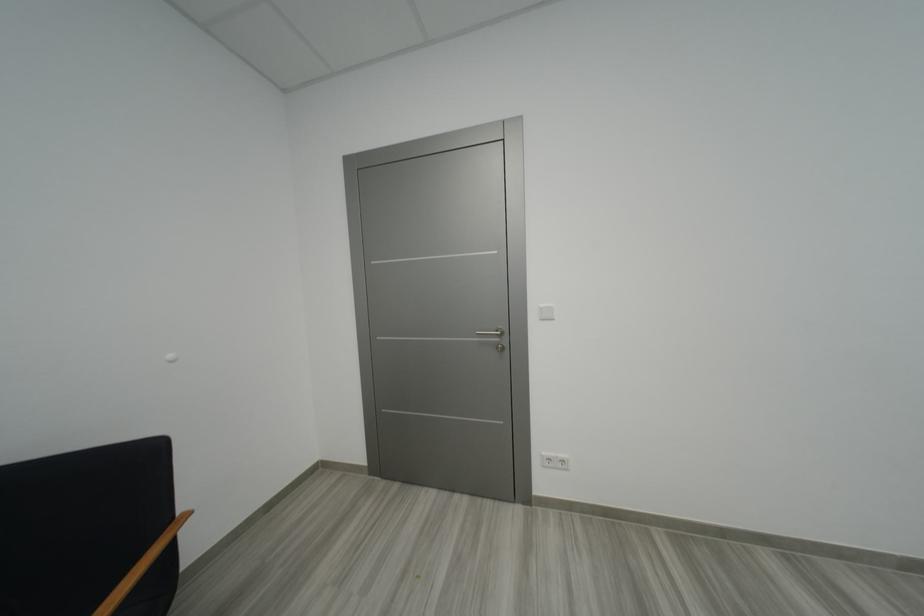
Image resolution: width=924 pixels, height=616 pixels. Identify the location of silver door handle. (492, 334).